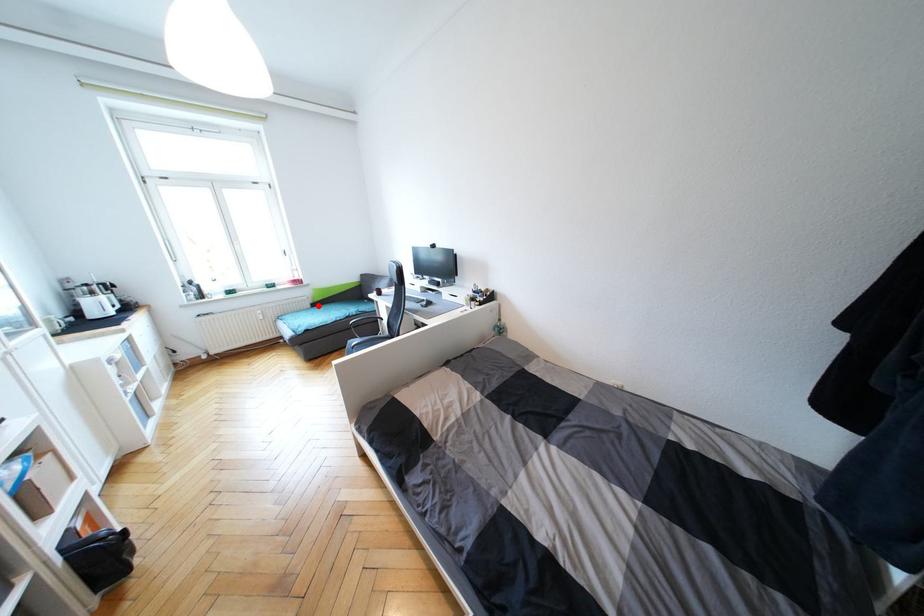
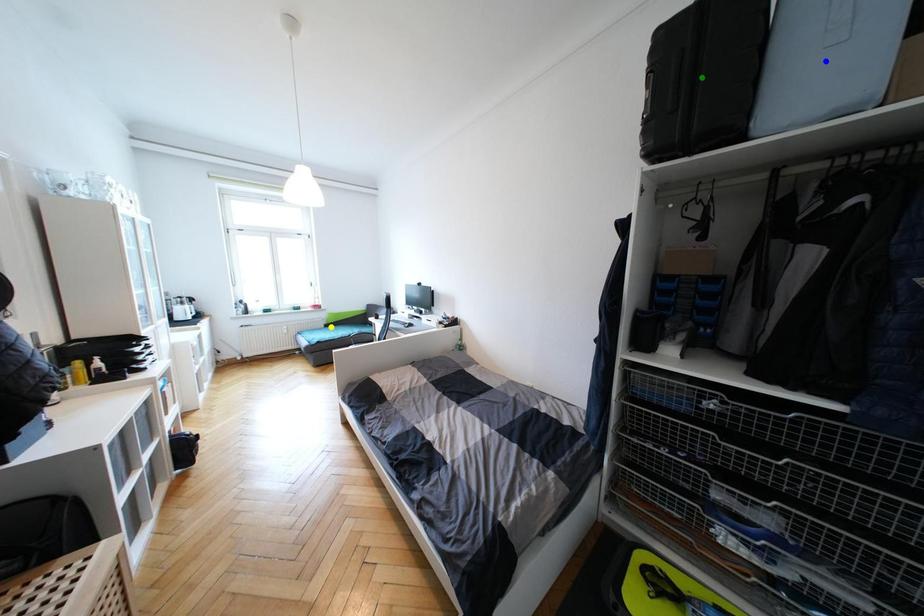
Question: I am providing you with two images of the same scene from different viewpoints. A red point is marked on the first image. You are given multiple points on the second image. Which mark in image 2 goes with the point in image 1?

Choices:
 (A) green point
 (B) blue point
 (C) yellow point

Answer: (C)